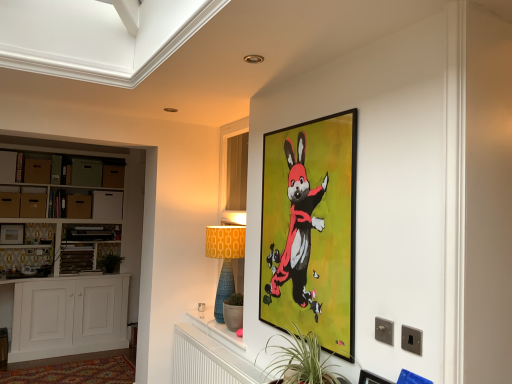
Question: Considering the relative positions of white wood cabinet at left, the 1th cabinetry when ordered from bottom to top, and matte black picture frame at upper right, which appears as the 3th picture frame when viewed from the left, in the image provided, is white wood cabinet at left, the 1th cabinetry when ordered from bottom to top, to the right of matte black picture frame at upper right, which appears as the 3th picture frame when viewed from the left, from the viewer's perspective?

Choices:
 (A) yes
 (B) no

Answer: (B)

Question: From the image's perspective, is white wood cabinet at left, the 1th cabinetry when ordered from bottom to top, under matte black picture frame at upper right, arranged as the 1th picture frame when viewed from the front?

Choices:
 (A) yes
 (B) no

Answer: (A)

Question: Is white wood cabinet at left, the 1th cabinetry when ordered from bottom to top, directly adjacent to matte black picture frame at upper right, arranged as the 1th picture frame when viewed from the front?

Choices:
 (A) yes
 (B) no

Answer: (B)

Question: Is white wood cabinet at left, which is counted as the second cabinetry, starting from the top, turned away from matte black picture frame at upper right, the 3th picture frame viewed from the back?

Choices:
 (A) no
 (B) yes

Answer: (A)

Question: Could you tell me if white wood cabinet at left, which is counted as the second cabinetry, starting from the top, is turned towards matte black picture frame at upper right, which appears as the 3th picture frame when viewed from the left?

Choices:
 (A) yes
 (B) no

Answer: (A)

Question: Is matte cardboard drawer at left, which is the fourth drawer in left-to-right order, in front of or behind blue textured lamp at center in the image?

Choices:
 (A) front
 (B) behind

Answer: (B)

Question: From the image's perspective, relative to blue textured lamp at center, is matte cardboard drawer at left, which is the fourth drawer in left-to-right order, above or below?

Choices:
 (A) below
 (B) above

Answer: (B)

Question: Is point (73, 210) positioned closer to the camera than point (236, 256)?

Choices:
 (A) farther
 (B) closer

Answer: (A)

Question: Is matte cardboard drawer at left, which is the fourth drawer in left-to-right order, wider or thinner than blue textured lamp at center?

Choices:
 (A) thin
 (B) wide

Answer: (A)

Question: From their relative heights in the image, would you say white wood cabinet at left, the first cabinetry positioned from the top, is taller or shorter than matte brown drawer at left, acting as the 1th drawer starting from the left?

Choices:
 (A) short
 (B) tall

Answer: (B)

Question: From the image's perspective, is white wood cabinet at left, the second cabinetry ordered from the bottom, positioned above or below matte brown drawer at left, acting as the 1th drawer starting from the left?

Choices:
 (A) above
 (B) below

Answer: (B)

Question: In terms of width, does white wood cabinet at left, the first cabinetry positioned from the top, look wider or thinner when compared to matte brown drawer at left, which is the 7th drawer in right-to-left order?

Choices:
 (A) thin
 (B) wide

Answer: (B)

Question: Based on their sizes in the image, would you say white wood cabinet at left, the second cabinetry ordered from the bottom, is bigger or smaller than matte brown drawer at left, acting as the 1th drawer starting from the left?

Choices:
 (A) small
 (B) big

Answer: (B)

Question: From a real-world perspective, is matte brown drawer at left, the sixth drawer from the right, above or below green leafy plant at lower center?

Choices:
 (A) below
 (B) above

Answer: (B)

Question: Is point (42, 203) closer or farther from the camera than point (298, 329)?

Choices:
 (A) farther
 (B) closer

Answer: (A)